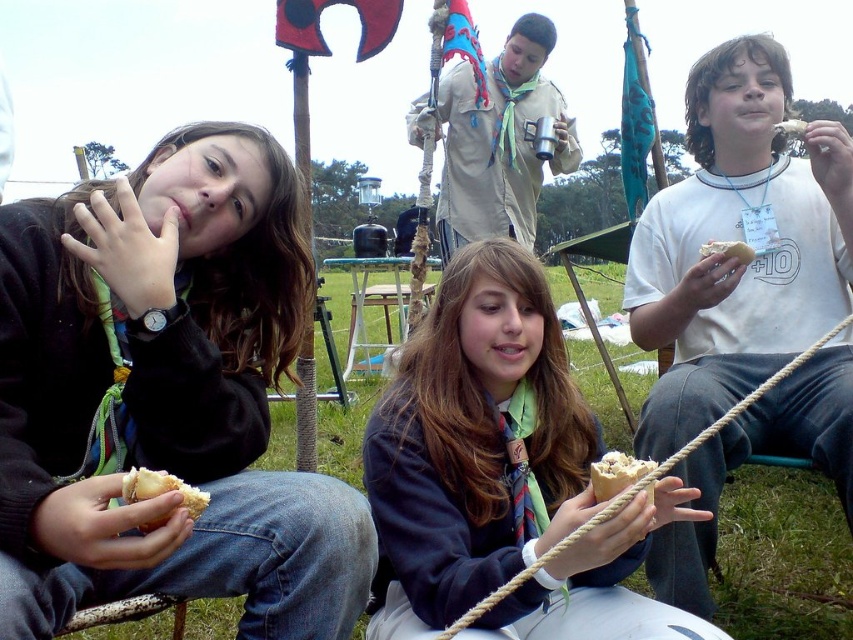
Can you confirm if brown crumbly bread at lower left is bigger than white bread at lower center?

No, brown crumbly bread at lower left is not bigger than white bread at lower center.

Does brown crumbly bread at lower left come behind white bread at lower center?

No, it is in front of white bread at lower center.

Who is more forward, (190, 497) or (646, 461)?

Positioned in front is point (190, 497).

Where is `brown crumbly bread at lower left`? This screenshot has height=640, width=853. brown crumbly bread at lower left is located at coordinates (161, 490).

Can you confirm if matte black sweater at left is thinner than white bread at right?

No.

Does point (366, 563) lie in front of point (735, 256)?

Yes, point (366, 563) is closer to viewer.

Is point (119, 364) positioned in front of point (750, 248)?

Yes, it is.

Identify the location of matte black sweater at left. (165, 396).

Does dark blue uniform at center appear on the right side of white bread at lower center?

No, dark blue uniform at center is not to the right of white bread at lower center.

Is point (503, 376) positioned in front of point (637, 472)?

No, it is behind (637, 472).

Where is `dark blue uniform at center`? The width and height of the screenshot is (853, 640). dark blue uniform at center is located at coordinates (477, 440).